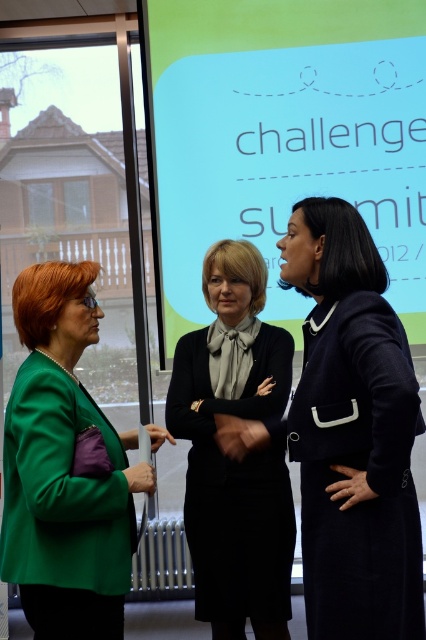
Question: Based on their relative distances, which object is farther from the green matte blazer at left?

Choices:
 (A) matte black screen at center
 (B) navy blue coat at center

Answer: (A)

Question: Can you confirm if matte black screen at center is bigger than matte black dress at center?

Choices:
 (A) yes
 (B) no

Answer: (A)

Question: Which object appears closest to the camera in this image?

Choices:
 (A) navy blue coat at center
 (B) matte black dress at center
 (C) matte black screen at center
 (D) green matte blazer at left

Answer: (A)

Question: Can you confirm if green matte blazer at left is thinner than matte black dress at center?

Choices:
 (A) yes
 (B) no

Answer: (B)

Question: Observing the image, what is the correct spatial positioning of navy blue coat at center in reference to matte black dress at center?

Choices:
 (A) right
 (B) left

Answer: (A)

Question: Which point appears farthest from the camera in this image?

Choices:
 (A) (63, 292)
 (B) (367, 173)
 (C) (221, 282)
 (D) (400, 621)

Answer: (B)